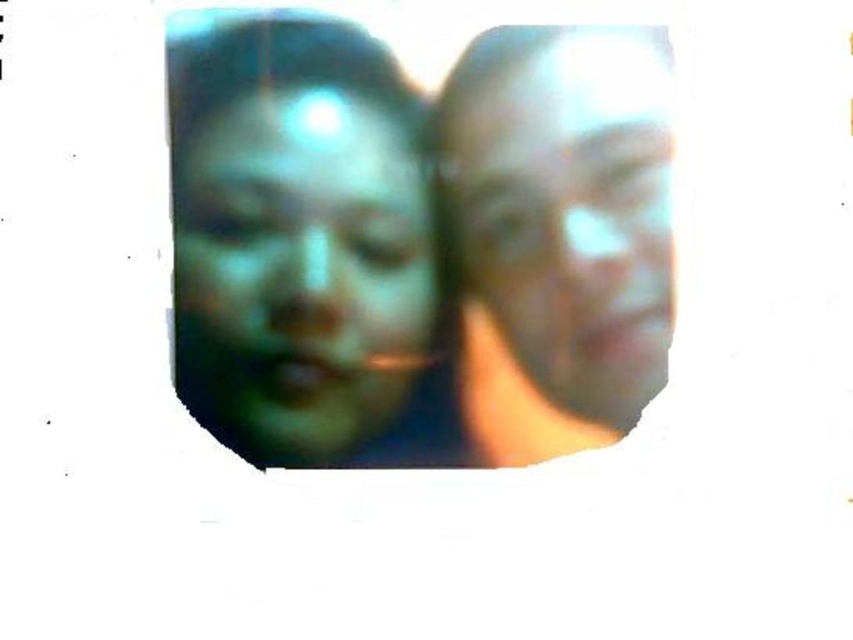
The height and width of the screenshot is (640, 853). I want to click on green matte face at center, so click(x=303, y=268).

Is green matte face at center above smooth skin face at right?

Actually, green matte face at center is below smooth skin face at right.

Between point (279, 236) and point (650, 333), which one is positioned behind?

The point (650, 333) is behind.

Locate an element on the screen. Image resolution: width=853 pixels, height=640 pixels. green matte face at center is located at coordinates click(303, 268).